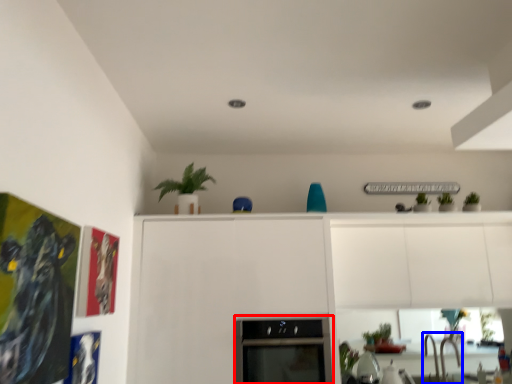
Question: Among these objects, which one is nearest to the camera, oven (highlighted by a red box) or sink (highlighted by a blue box)?

Choices:
 (A) oven
 (B) sink

Answer: (A)